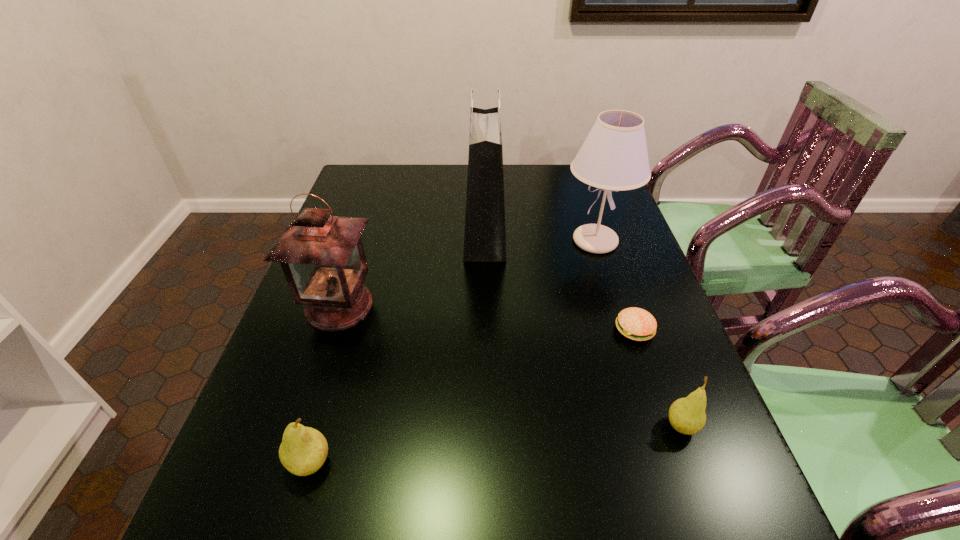
This screenshot has height=540, width=960. What are the coordinates of `the left pear` in the screenshot? It's located at (303, 450).

This screenshot has height=540, width=960. I want to click on the taller pear, so click(x=303, y=450).

I want to click on the shorter pear, so click(x=687, y=415).

What are the coordinates of `the fifth tallest object` in the screenshot? It's located at (687, 415).

Find the location of `lampshade`. lampshade is located at coordinates (613, 157).

The image size is (960, 540). I want to click on the third object from left to right, so click(x=484, y=236).

Locate an element on the screen. The height and width of the screenshot is (540, 960). patty is located at coordinates point(637,324).

Locate an element on the screen. oil lamp is located at coordinates (322, 256).

Identify the location of blank space located 0.380m on the right of the left pear. (540, 463).

The width and height of the screenshot is (960, 540). Find the location of `free location located 0.220m on the left of the shorter pear`. free location located 0.220m on the left of the shorter pear is located at coordinates (552, 427).